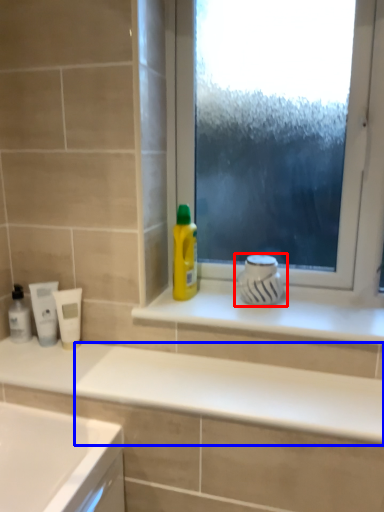
Question: Which point is closer to the camera, appliance (highlighted by a red box) or counter top (highlighted by a blue box)?

Choices:
 (A) appliance
 (B) counter top

Answer: (B)